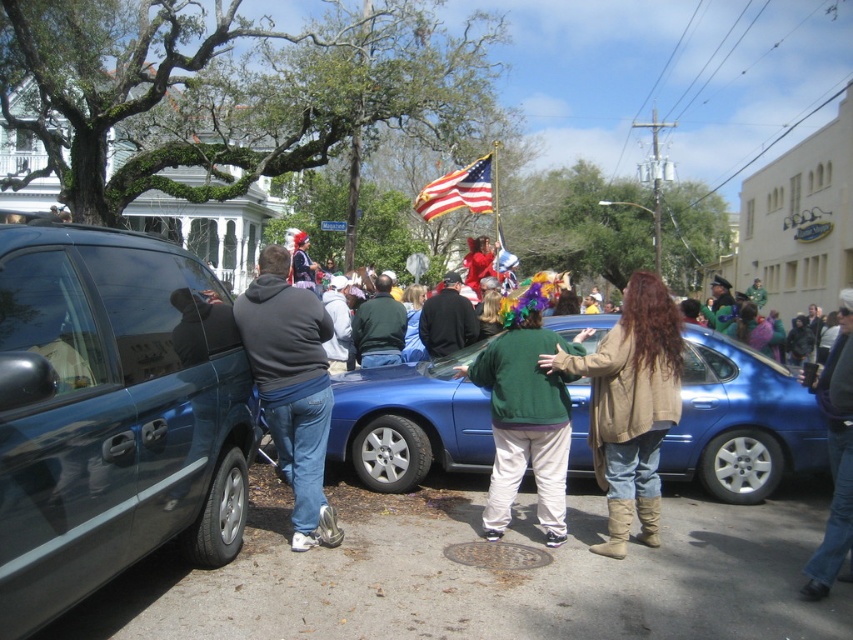
Question: Which of the following is the closest to the observer?

Choices:
 (A) dark gray hoodie at center
 (B) metallic blue minivan at left

Answer: (B)

Question: Which is nearer to the black matte jacket at center?

Choices:
 (A) american flag at center
 (B) metallic blue minivan at left
 (C) green sweater at center
 (D) dark gray hoodie at center

Answer: (C)

Question: Can you confirm if metallic blue minivan at left is bigger than green fleece jacket at center?

Choices:
 (A) no
 (B) yes

Answer: (B)

Question: Can you confirm if blue jeans at right is bigger than green matte jacket at center?

Choices:
 (A) no
 (B) yes

Answer: (B)

Question: Can you confirm if green fleece jacket at center is wider than green matte jacket at center?

Choices:
 (A) yes
 (B) no

Answer: (A)

Question: Which of the following is the closest to the observer?

Choices:
 (A) dark gray hoodie at center
 (B) blue jeans at right
 (C) black matte jacket at center

Answer: (B)